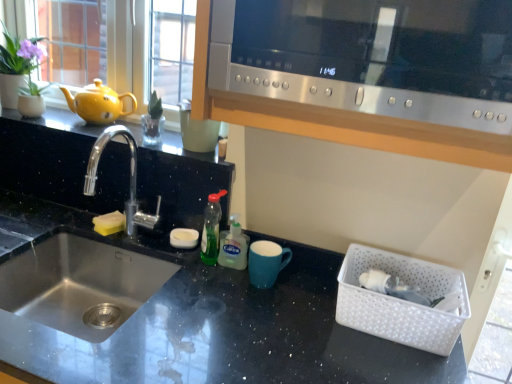
This screenshot has width=512, height=384. I want to click on free space underneath yellow matte teapot at left (from a real-world perspective), so click(x=97, y=118).